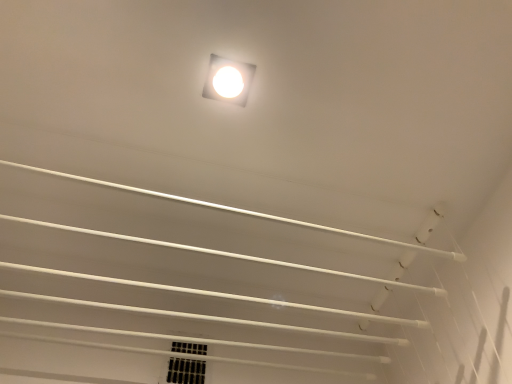
Question: Are white glossy square lamp at upper center and black mesh vent at lower center making contact?

Choices:
 (A) no
 (B) yes

Answer: (A)

Question: Is white glossy square lamp at upper center not within black mesh vent at lower center?

Choices:
 (A) no
 (B) yes

Answer: (B)

Question: Would you say white glossy square lamp at upper center contains black mesh vent at lower center?

Choices:
 (A) no
 (B) yes

Answer: (A)

Question: Is white glossy square lamp at upper center shorter than black mesh vent at lower center?

Choices:
 (A) yes
 (B) no

Answer: (A)

Question: Considering the relative sizes of white glossy square lamp at upper center and black mesh vent at lower center in the image provided, is white glossy square lamp at upper center wider than black mesh vent at lower center?

Choices:
 (A) yes
 (B) no

Answer: (A)

Question: Does white glossy square lamp at upper center come in front of black mesh vent at lower center?

Choices:
 (A) no
 (B) yes

Answer: (B)

Question: From a real-world perspective, is black mesh vent at lower center located higher than white glossy square lamp at upper center?

Choices:
 (A) no
 (B) yes

Answer: (A)

Question: Is black mesh vent at lower center far away from white glossy square lamp at upper center?

Choices:
 (A) no
 (B) yes

Answer: (A)

Question: Does black mesh vent at lower center turn towards white glossy square lamp at upper center?

Choices:
 (A) no
 (B) yes

Answer: (B)

Question: Can you confirm if black mesh vent at lower center is bigger than white glossy square lamp at upper center?

Choices:
 (A) yes
 (B) no

Answer: (A)

Question: Is black mesh vent at lower center not inside white glossy square lamp at upper center?

Choices:
 (A) yes
 (B) no

Answer: (A)

Question: Is black mesh vent at lower center shorter than white glossy square lamp at upper center?

Choices:
 (A) yes
 (B) no

Answer: (B)

Question: Is black mesh vent at lower center to the left or to the right of white glossy square lamp at upper center in the image?

Choices:
 (A) right
 (B) left

Answer: (B)